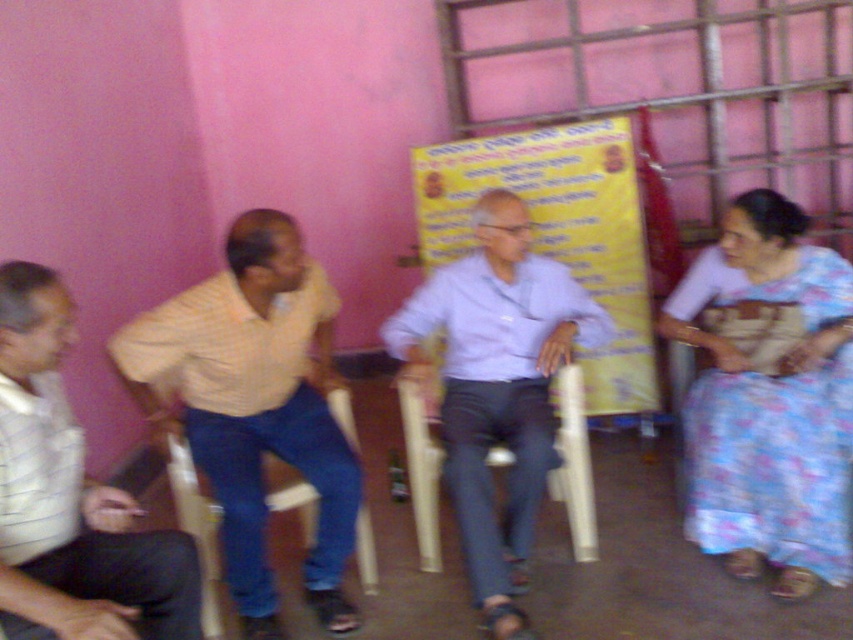
You are standing at the point labeled point (10,611) and want to take a photo of the group. The camera you have can only focus on objects within 5 feet. Will the camera be able to focus on the group?

The point labeled point (10,611) and the camera are 5.13 feet apart, which is slightly beyond the camera focus range of 5 feet. Therefore, the camera will not be able to focus on the group.

You are an interior designer observing the scene. You need to determine if the floral fabric saree at right can be displayed on a stand that is the same height as the blue fabric chair at center. Based on their heights, what is your assessment?

→ The floral fabric saree at right is much taller than the blue fabric chair at center, so it cannot be displayed on a stand of the same height since the saree is taller.